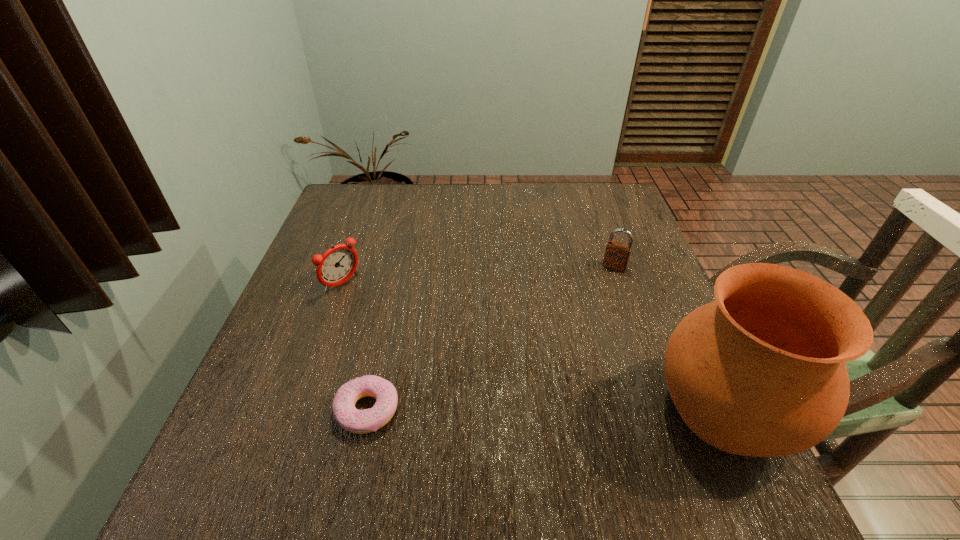
Where is `vacant space at the near edge`? vacant space at the near edge is located at coordinates (449, 420).

The width and height of the screenshot is (960, 540). In order to click on free region at the left edge of the desktop in this screenshot , I will do click(358, 292).

Locate an element on the screen. Image resolution: width=960 pixels, height=540 pixels. vacant space at the right edge of the desktop is located at coordinates (620, 296).

Identify the location of free space at the far left corner of the desktop. (369, 184).

Find the location of `blank space at the near left corner of the desktop`. blank space at the near left corner of the desktop is located at coordinates coord(253,429).

The width and height of the screenshot is (960, 540). I want to click on free space at the far right corner of the desktop, so click(x=590, y=208).

In the image, there is a desktop. At what (x,y) coordinates should I click in order to perform the action: click on free region at the near right corner. Please return your answer as a coordinate pair (x, y). The height and width of the screenshot is (540, 960). Looking at the image, I should click on (672, 449).

Where is `free spot between the tallest object and the second object from left to right`? free spot between the tallest object and the second object from left to right is located at coordinates (546, 410).

Identify the location of free space between the shortest object and the leftmost object. (355, 347).

Where is `free space between the leftmost object and the doughnut`? free space between the leftmost object and the doughnut is located at coordinates (355, 347).